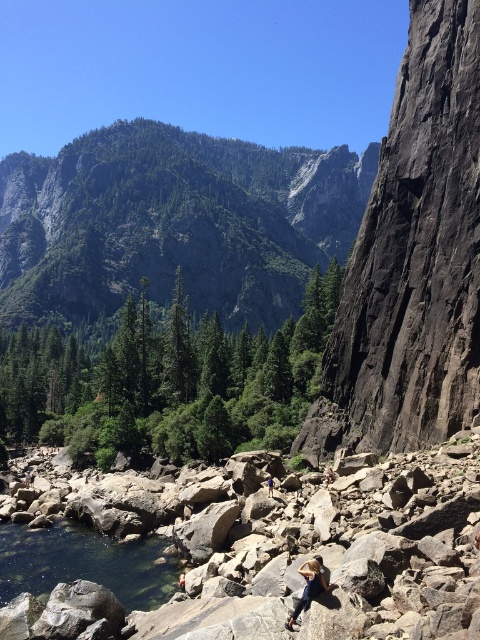
Question: Which point is farther to the camera?

Choices:
 (A) denim jacket at lower center
 (B) green forested mountain at upper center
 (C) black rock cliff at right

Answer: (B)

Question: Is black rock cliff at right behind clear glass water at lower left?

Choices:
 (A) yes
 (B) no

Answer: (A)

Question: Based on their relative distances, which object is farther from the clear glass water at lower left?

Choices:
 (A) blue denim jeans at center
 (B) green forested mountain at upper center
 (C) black rock cliff at right

Answer: (B)

Question: Does green forested mountain at upper center have a lesser width compared to denim jacket at lower center?

Choices:
 (A) yes
 (B) no

Answer: (B)

Question: Considering the relative positions of black rock cliff at right and blue denim jeans at center in the image provided, where is black rock cliff at right located with respect to blue denim jeans at center?

Choices:
 (A) left
 (B) right

Answer: (B)

Question: Among these points, which one is farthest from the camera?

Choices:
 (A) (268, 480)
 (B) (373, 323)
 (C) (321, 586)

Answer: (B)